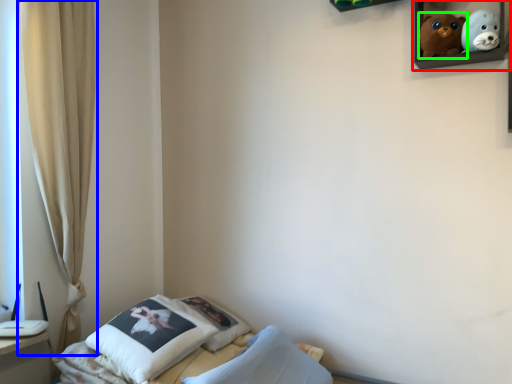
Question: Which is nearer to the picture frame (highlighted by a red box)? curtain (highlighted by a blue box) or toy (highlighted by a green box).

Choices:
 (A) curtain
 (B) toy

Answer: (B)